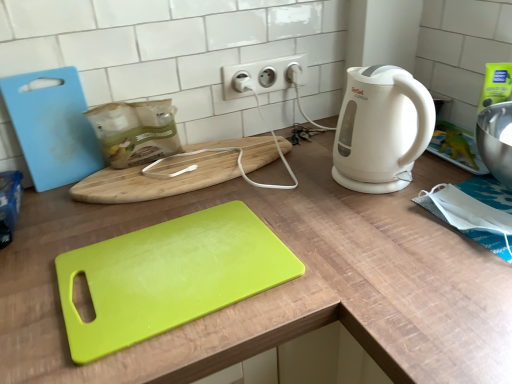
Find the location of a particular element. The width and height of the screenshot is (512, 384). free point above lime green plastic cutting board at center (from a real-world perspective) is located at coordinates pyautogui.click(x=113, y=243).